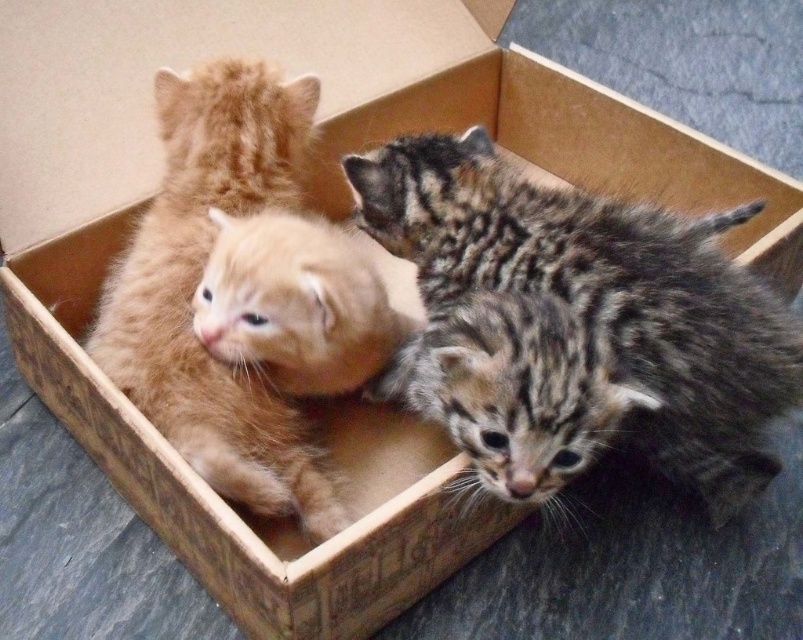
Question: Which object is closer to the camera taking this photo?

Choices:
 (A) tabby fur kitten at center
 (B) soft orange fur kitten at center
 (C) matte orange kitten at center

Answer: (B)

Question: Is tabby fur kitten at center below soft orange fur kitten at center?

Choices:
 (A) no
 (B) yes

Answer: (A)

Question: Considering the real-world distances, which object is closest to the soft orange fur kitten at center?

Choices:
 (A) tabby fur kitten at center
 (B) matte orange kitten at center

Answer: (B)

Question: Which point is closer to the camera?

Choices:
 (A) soft orange fur kitten at center
 (B) tabby fur kitten at center
 (C) matte orange kitten at center

Answer: (A)

Question: Observing the image, what is the correct spatial positioning of tabby fur kitten at center in reference to matte orange kitten at center?

Choices:
 (A) below
 (B) above

Answer: (B)

Question: Is tabby fur kitten at center smaller than matte orange kitten at center?

Choices:
 (A) yes
 (B) no

Answer: (B)